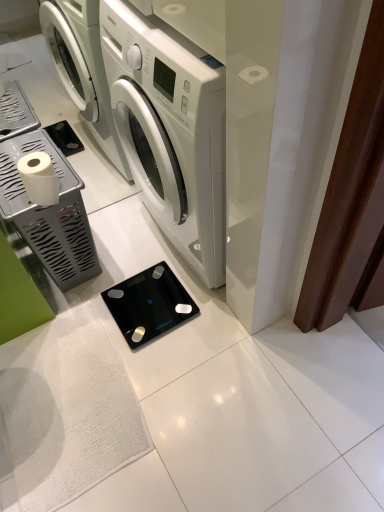
Question: Does white glossy washing machine at center have a lesser height compared to black glass scale at center, the 2th appliance from the left?

Choices:
 (A) no
 (B) yes

Answer: (A)

Question: Is white glossy washing machine at center to the right of black glass scale at center, the 2th appliance from the left, from the viewer's perspective?

Choices:
 (A) no
 (B) yes

Answer: (B)

Question: From the image's perspective, is white glossy washing machine at center beneath black glass scale at center, the 2th appliance from the left?

Choices:
 (A) no
 (B) yes

Answer: (A)

Question: Is the position of white glossy washing machine at center more distant than that of black glass scale at center, the 2th appliance from the left?

Choices:
 (A) yes
 (B) no

Answer: (B)

Question: Can you confirm if white glossy washing machine at center is smaller than black glass scale at center, the 2th appliance from the left?

Choices:
 (A) yes
 (B) no

Answer: (B)

Question: Considering the positions of black glass scale at center, acting as the first appliance starting from the right, and silver metallic toilet paper holder at left, which is counted as the 2th appliance, starting from the right, in the image, is black glass scale at center, acting as the first appliance starting from the right, bigger or smaller than silver metallic toilet paper holder at left, which is counted as the 2th appliance, starting from the right,?

Choices:
 (A) big
 (B) small

Answer: (B)

Question: Is black glass scale at center, acting as the first appliance starting from the right, taller or shorter than silver metallic toilet paper holder at left, placed as the 1th appliance when sorted from left to right?

Choices:
 (A) tall
 (B) short

Answer: (B)

Question: Considering their positions, is black glass scale at center, acting as the first appliance starting from the right, located in front of or behind silver metallic toilet paper holder at left, which is counted as the 2th appliance, starting from the right?

Choices:
 (A) front
 (B) behind

Answer: (B)

Question: Do you think black glass scale at center, the 2th appliance from the left, is within silver metallic toilet paper holder at left, which is counted as the 2th appliance, starting from the right, or outside of it?

Choices:
 (A) inside
 (B) outside

Answer: (B)

Question: Is black glass scale at center, acting as the first appliance starting from the right, situated inside white matte toilet paper at left or outside?

Choices:
 (A) inside
 (B) outside

Answer: (B)

Question: Would you say black glass scale at center, acting as the first appliance starting from the right, is to the left or to the right of white matte toilet paper at left in the picture?

Choices:
 (A) left
 (B) right

Answer: (B)

Question: Is black glass scale at center, acting as the first appliance starting from the right, bigger or smaller than white matte toilet paper at left?

Choices:
 (A) big
 (B) small

Answer: (B)

Question: Does point (147, 288) appear closer or farther from the camera than point (23, 180)?

Choices:
 (A) farther
 (B) closer

Answer: (A)

Question: Is silver metallic toilet paper holder at left, which is counted as the 2th appliance, starting from the right, inside or outside of black glass scale at center, the 2th appliance from the left?

Choices:
 (A) inside
 (B) outside

Answer: (B)

Question: Is point (29, 216) positioned closer to the camera than point (168, 303)?

Choices:
 (A) closer
 (B) farther

Answer: (A)